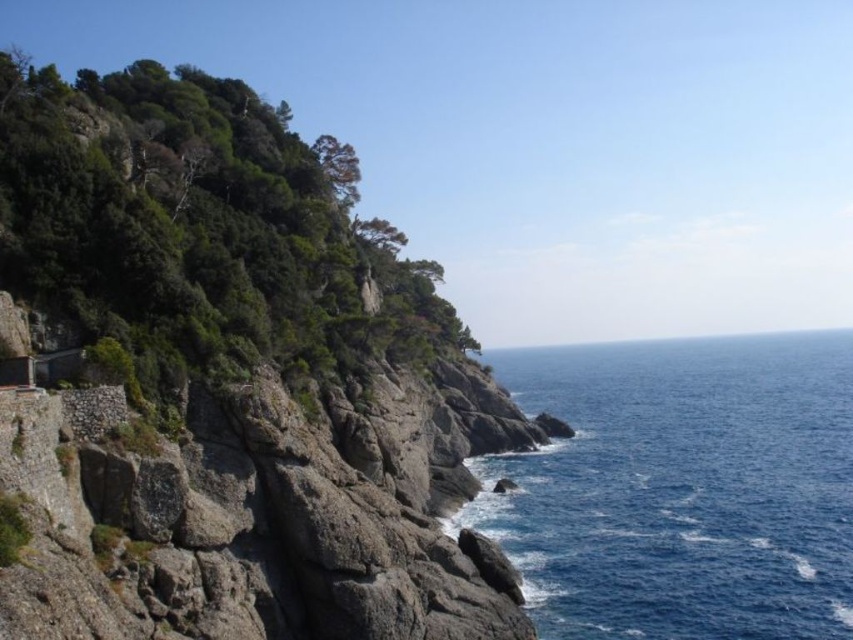
Can you confirm if green leafy hillside at upper left is positioned to the right of blue water at right?

No, green leafy hillside at upper left is not to the right of blue water at right.

Who is shorter, green leafy hillside at upper left or blue water at right?

blue water at right is shorter.

Who is more distant from viewer, (306,328) or (604,624)?

The point (306,328) is more distant.

Identify the location of green leafy hillside at upper left. (224, 385).